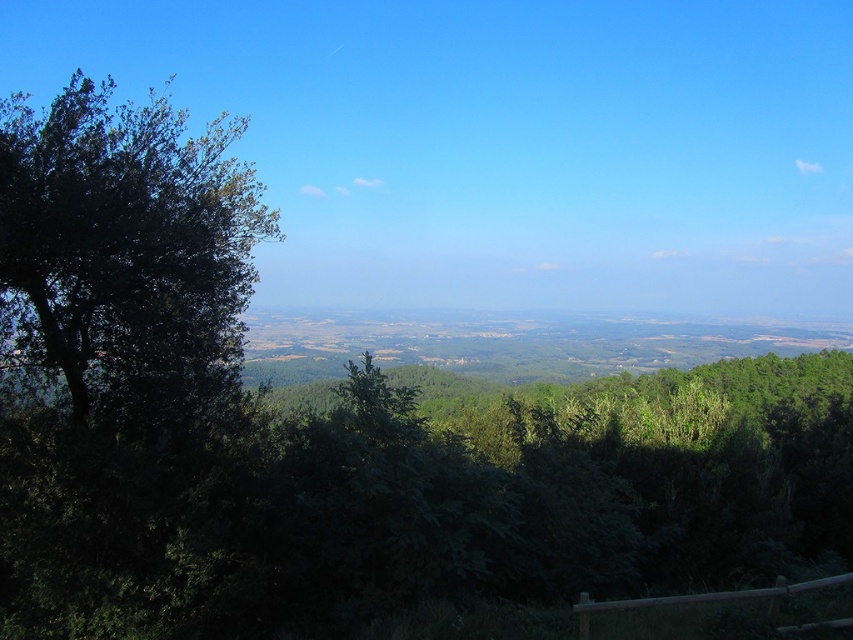
Question: Is green leafy tree at left closer to the viewer compared to dark green leafy tree at left?

Choices:
 (A) yes
 (B) no

Answer: (A)

Question: Is the position of green leafy tree at left less distant than that of dark green leafy tree at left?

Choices:
 (A) no
 (B) yes

Answer: (B)

Question: Which of the following is the farthest from the observer?

Choices:
 (A) (399, 468)
 (B) (79, 346)

Answer: (B)

Question: Does green leafy tree at left appear under dark green leafy tree at left?

Choices:
 (A) yes
 (B) no

Answer: (A)

Question: Among these points, which one is nearest to the camera?

Choices:
 (A) (84, 369)
 (B) (363, 435)

Answer: (B)